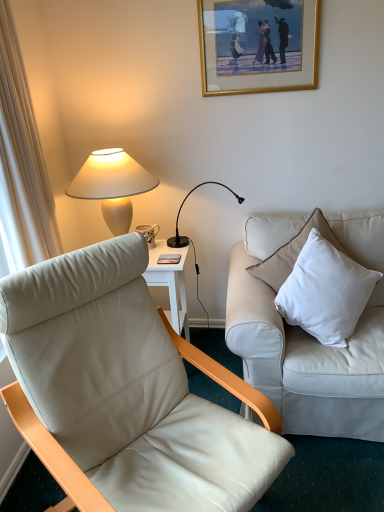
Question: From the image's perspective, relative to gold-framed picture at upper center, is black metal/texture desk lamp at upper center, which ranks as the 2th lamp in left-to-right order, above or below?

Choices:
 (A) above
 (B) below

Answer: (B)

Question: In terms of width, does black metal/texture desk lamp at upper center, the first lamp from the right, look wider or thinner when compared to gold-framed picture at upper center?

Choices:
 (A) thin
 (B) wide

Answer: (B)

Question: Which object is positioned closest to the leather chair at left?

Choices:
 (A) white cotton pillow at right
 (B) black metal/texture desk lamp at upper center, which ranks as the 2th lamp in left-to-right order
 (C) white leather couch at right
 (D) white ceramic lamp at upper left, arranged as the 1th lamp when viewed from the left
 (E) matte ceramic mug at upper center

Answer: (C)

Question: Based on their relative distances, which object is nearer to the white leather couch at right?

Choices:
 (A) matte ceramic mug at upper center
 (B) leather chair at left
 (C) gold-framed picture at upper center
 (D) white cotton pillow at right
 (E) white ceramic lamp at upper left, arranged as the 1th lamp when viewed from the left

Answer: (D)